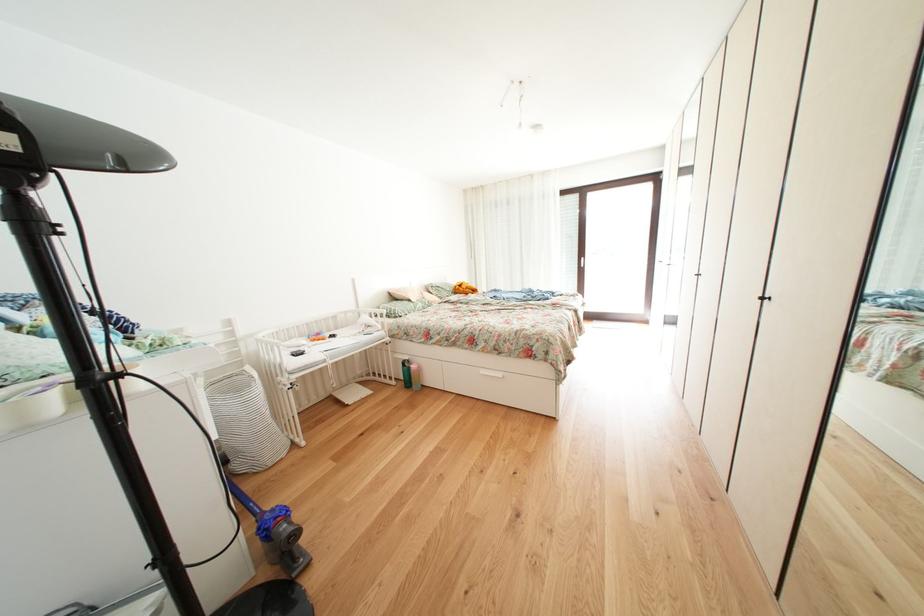
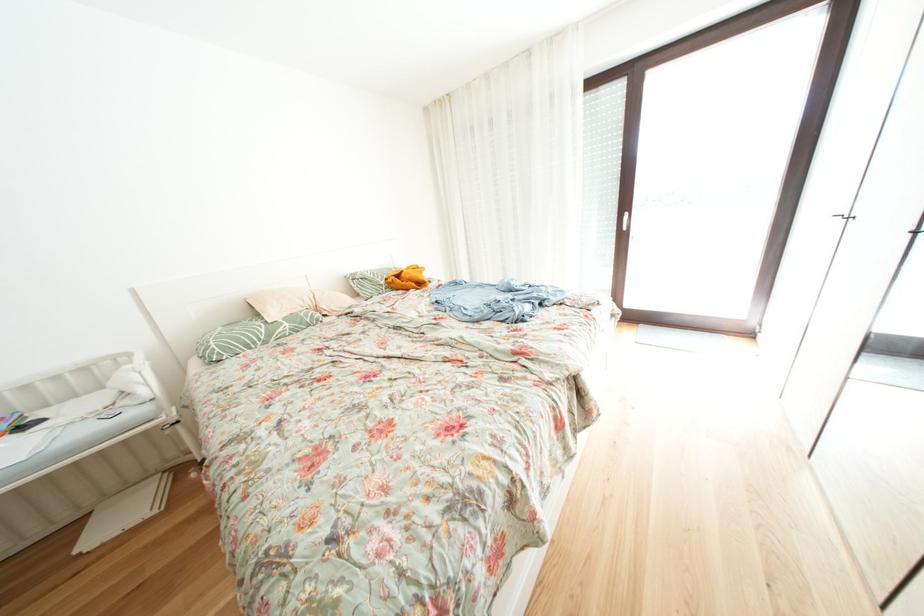
In the second image, find the point that corresponds to (657,328) in the first image.

(759, 339)